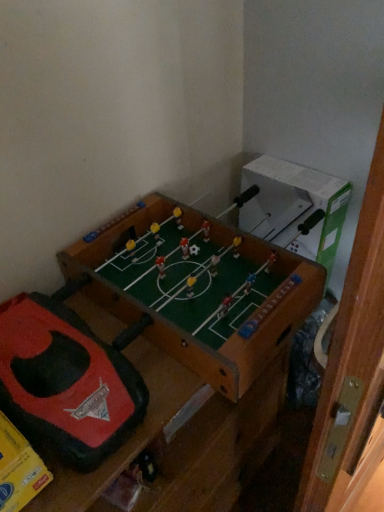
I want to click on rubberized red and black toy at center, so click(x=66, y=383).

This screenshot has height=512, width=384. Describe the element at coordinates (66, 383) in the screenshot. I see `rubberized red and black toy at center` at that location.

What is the approximate width of rubberized red and black toy at center?

It is 15.17 inches.

The width and height of the screenshot is (384, 512). I want to click on wooden foosball table at center, so click(153, 366).

Image resolution: width=384 pixels, height=512 pixels. What do you see at coordinates (153, 366) in the screenshot?
I see `wooden foosball table at center` at bounding box center [153, 366].

Based on the photo, what is the approximate width of wooden foosball table at center?

wooden foosball table at center is 45.61 centimeters in width.

Measure the distance between wooden foosball table at center and camera.

wooden foosball table at center is 24.95 inches away from camera.

You are a GUI agent. You are given a task and a screenshot of the screen. Output one action in this format:
    pyautogui.click(x=<x>, y=<y>)
    Task: Click on the rubberized red and black toy at center
    
    Given the screenshot: What is the action you would take?
    pyautogui.click(x=66, y=383)

Which is more to the left, wooden foosball table at center or rubberized red and black toy at center?

Positioned to the left is rubberized red and black toy at center.

Based on the photo, is the position of wooden foosball table at center more distant than that of rubberized red and black toy at center?

No, wooden foosball table at center is closer to the camera.

Is point (123, 429) behind point (104, 358)?

That is False.

From the image's perspective, which object appears higher, wooden foosball table at center or rubberized red and black toy at center?

rubberized red and black toy at center, from the image's perspective.

From a real-world perspective, who is located lower, wooden foosball table at center or rubberized red and black toy at center?

wooden foosball table at center is physically lower.

Consider the image. Can you confirm if wooden foosball table at center is wider than rubberized red and black toy at center?

Correct, the width of wooden foosball table at center exceeds that of rubberized red and black toy at center.

Who is shorter, wooden foosball table at center or rubberized red and black toy at center?

With less height is rubberized red and black toy at center.

Considering the sizes of objects wooden foosball table at center and rubberized red and black toy at center in the image provided, who is smaller, wooden foosball table at center or rubberized red and black toy at center?

With smaller size is rubberized red and black toy at center.

Does wooden foosball table at center contain rubberized red and black toy at center?

Yes, rubberized red and black toy at center is a part of wooden foosball table at center.

Is there a large distance between wooden foosball table at center and rubberized red and black toy at center?

No, wooden foosball table at center is in close proximity to rubberized red and black toy at center.

Is wooden foosball table at center oriented away from rubberized red and black toy at center?

No, wooden foosball table at center is not facing away from rubberized red and black toy at center.

Can you tell me how much wooden foosball table at center and rubberized red and black toy at center differ in facing direction?

The angle between the facing direction of wooden foosball table at center and the facing direction of rubberized red and black toy at center is 0.239 degrees.

Identify the location of furniture in front of the rubberized red and black toy at center. (153, 366).

Which is more to the right, rubberized red and black toy at center or wooden foosball table at center?

From the viewer's perspective, wooden foosball table at center appears more on the right side.

Is rubberized red and black toy at center in front of or behind wooden foosball table at center in the image?

In the image, rubberized red and black toy at center appears behind wooden foosball table at center.

Which is in front, point (124, 391) or point (89, 437)?

Positioned in front is point (89, 437).

From the image's perspective, is rubberized red and black toy at center over wooden foosball table at center?

Yes.

From a real-world perspective, is rubberized red and black toy at center over wooden foosball table at center?

Indeed, from a real-world perspective, rubberized red and black toy at center stands above wooden foosball table at center.

Can you confirm if rubberized red and black toy at center is wider than wooden foosball table at center?

No.

Between rubberized red and black toy at center and wooden foosball table at center, which one has less height?

With less height is rubberized red and black toy at center.

Can you confirm if rubberized red and black toy at center is bigger than wooden foosball table at center?

No.

Is wooden foosball table at center inside rubberized red and black toy at center?

No, wooden foosball table at center is located outside of rubberized red and black toy at center.

Is the surface of rubberized red and black toy at center in direct contact with wooden foosball table at center?

No, rubberized red and black toy at center is not touching wooden foosball table at center.

Is rubberized red and black toy at center facing away from wooden foosball table at center?

Yes, rubberized red and black toy at center is positioned with its back facing wooden foosball table at center.

How many degrees apart are the facing directions of rubberized red and black toy at center and wooden foosball table at center?

There is a 0.239-degree angle between the facing directions of rubberized red and black toy at center and wooden foosball table at center.

Identify the location of furniture below the rubberized red and black toy at center (from the image's perspective). The height and width of the screenshot is (512, 384). (153, 366).

The image size is (384, 512). Find the location of `furniture that appears on the right of rubberized red and black toy at center`. furniture that appears on the right of rubberized red and black toy at center is located at coordinates (153, 366).

There is a wooden foosball table at center. At what (x,y) coordinates should I click in order to perform the action: click on toy above it (from a real-world perspective). Please return your answer as a coordinate pair (x, y). This screenshot has height=512, width=384. Looking at the image, I should click on (66, 383).